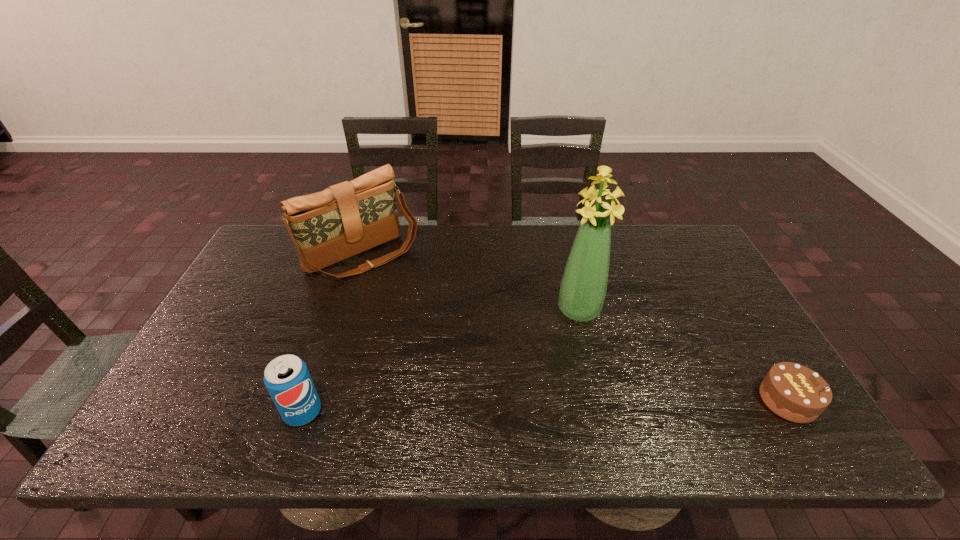
At what (x,y) coordinates should I click in order to perform the action: click on vacant space that satisfies the following two spatial constraints: 1. on the back side of the rightmost object; 2. on the left side of the third tallest object. Please return your answer as a coordinate pair (x, y). This screenshot has width=960, height=540. Looking at the image, I should click on click(x=307, y=400).

The image size is (960, 540). What are the coordinates of `free space in the image that satisfies the following two spatial constraints: 1. on the back side of the shoulder bag; 2. on the right side of the third tallest object` in the screenshot? It's located at (356, 255).

The image size is (960, 540). I want to click on free spot that satisfies the following two spatial constraints: 1. on the back side of the third shortest object; 2. on the left side of the soda can, so click(356, 255).